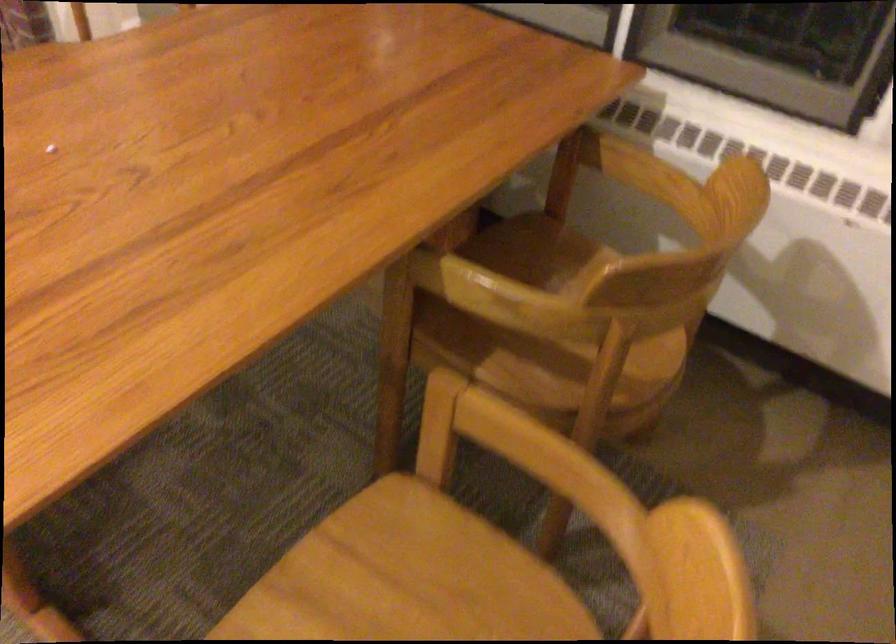
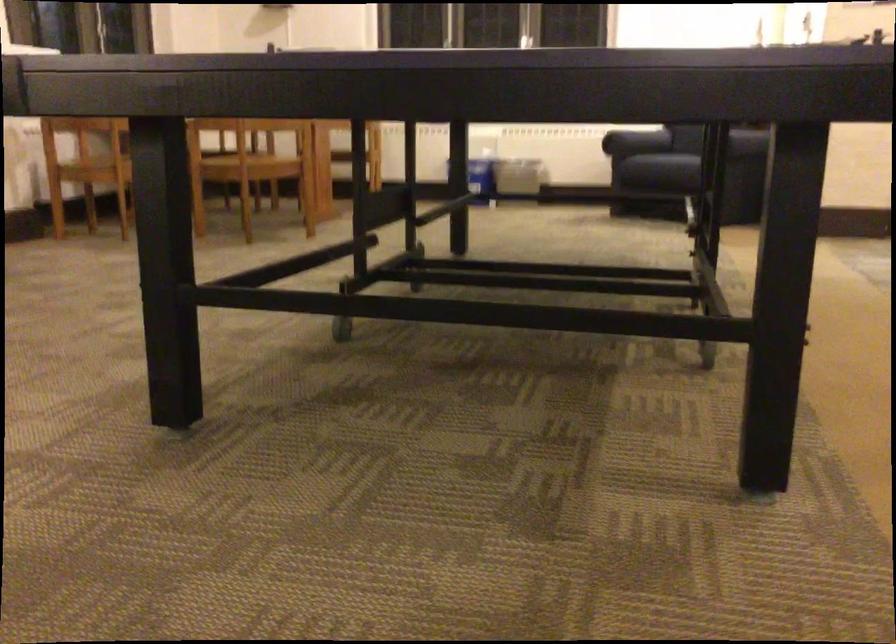
Question: I am providing you with two images of the same scene from different viewpoints. Which of the following objects are not visible in image2?

Choices:
 (A) sofa sitting surface
 (B) wooden chair sitting surface
 (C) vacuum cleaner hose
 (D) chair sitting surface

Answer: (B)